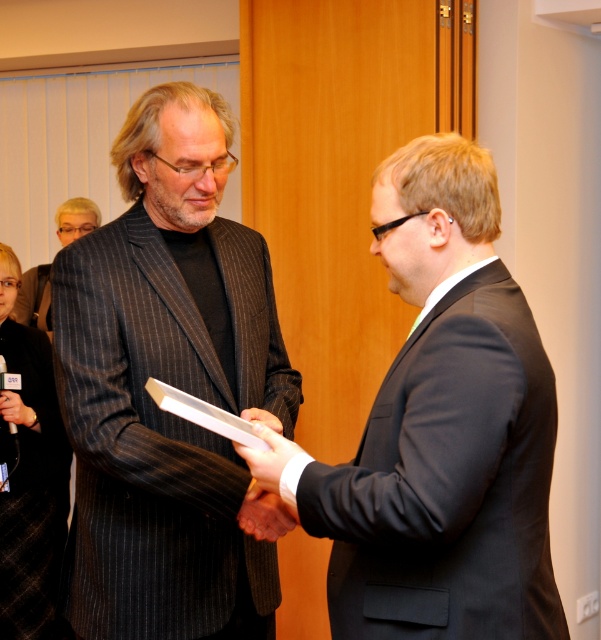
Question: Considering the relative positions of dark gray pinstripe suit at center and black pinstripe suit at lower left in the image provided, where is dark gray pinstripe suit at center located with respect to black pinstripe suit at lower left?

Choices:
 (A) left
 (B) right

Answer: (B)

Question: Which of these objects is positioned farthest from the black pinstripe suit at center?

Choices:
 (A) dark gray pinstripe suit at center
 (B) black suit at center

Answer: (B)

Question: Can you confirm if black suit at center is positioned above black pinstripe suit at left?

Choices:
 (A) yes
 (B) no

Answer: (B)

Question: Which of the following is the closest to the observer?

Choices:
 (A) black pinstripe suit at lower left
 (B) white paper at center
 (C) black pinstripe suit at left

Answer: (B)

Question: Does black pinstripe suit at lower left have a lesser width compared to black pinstripe suit at left?

Choices:
 (A) no
 (B) yes

Answer: (B)

Question: Which object is the farthest from the black suit at center?

Choices:
 (A) white paper at center
 (B) black pinstripe suit at center

Answer: (B)